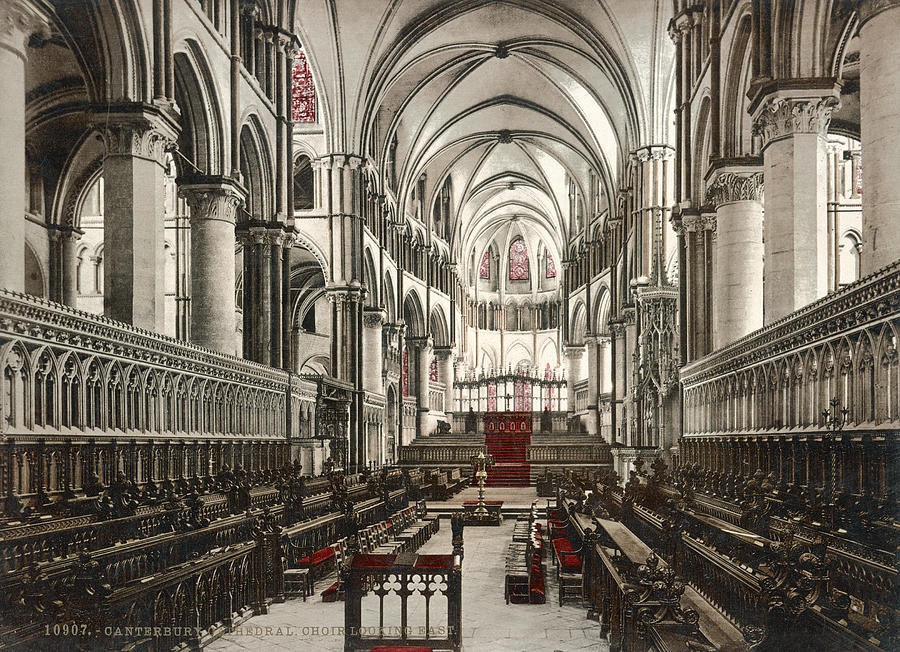
The image size is (900, 652). I want to click on pillar, so click(147, 261).